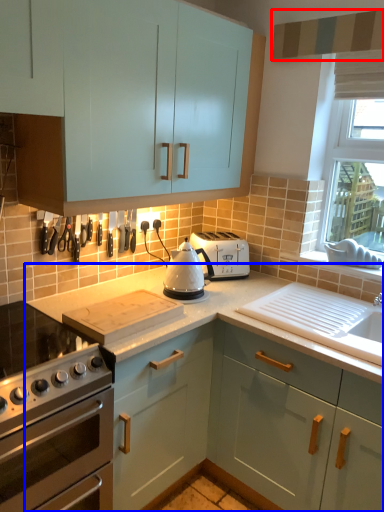
Question: Among these objects, which one is farthest to the camera, exhaust hood (highlighted by a red box) or countertop (highlighted by a blue box)?

Choices:
 (A) exhaust hood
 (B) countertop

Answer: (A)